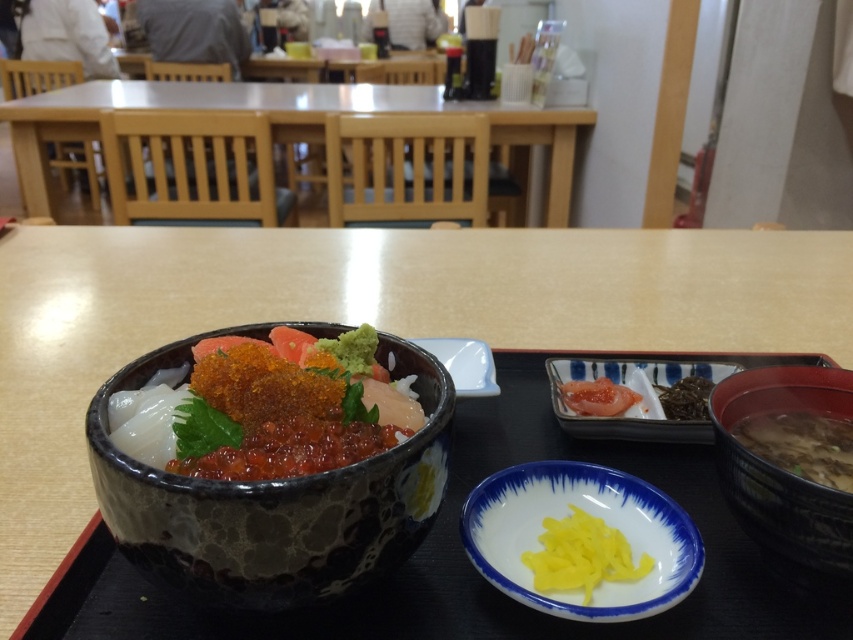
Who is higher up, brown ceramic bowl at lower right or dark brown seaweed at upper right?

Positioned higher is dark brown seaweed at upper right.

Between brown ceramic bowl at lower right and dark brown seaweed at upper right, which one is positioned lower?

Positioned lower is brown ceramic bowl at lower right.

The width and height of the screenshot is (853, 640). Identify the location of brown ceramic bowl at lower right. (782, 468).

Is point (782, 429) closer to viewer compared to point (688, 410)?

That is True.

In the scene shown: Is brown matte soup bowl at lower right to the right of dark brown seaweed at upper right from the viewer's perspective?

Yes, brown matte soup bowl at lower right is to the right of dark brown seaweed at upper right.

Who is more forward, [813,451] or [674,388]?

Point [813,451] is in front.

Image resolution: width=853 pixels, height=640 pixels. Find the location of `brown matte soup bowl at lower right`. brown matte soup bowl at lower right is located at coordinates (801, 444).

Between shiny ceramic bowl of sashimi at center and brown ceramic bowl at lower right, which one is positioned lower?

brown ceramic bowl at lower right

Can you confirm if shiny ceramic bowl of sashimi at center is shorter than brown ceramic bowl at lower right?

Indeed, shiny ceramic bowl of sashimi at center has a lesser height compared to brown ceramic bowl at lower right.

The height and width of the screenshot is (640, 853). I want to click on shiny ceramic bowl of sashimi at center, so pos(260,413).